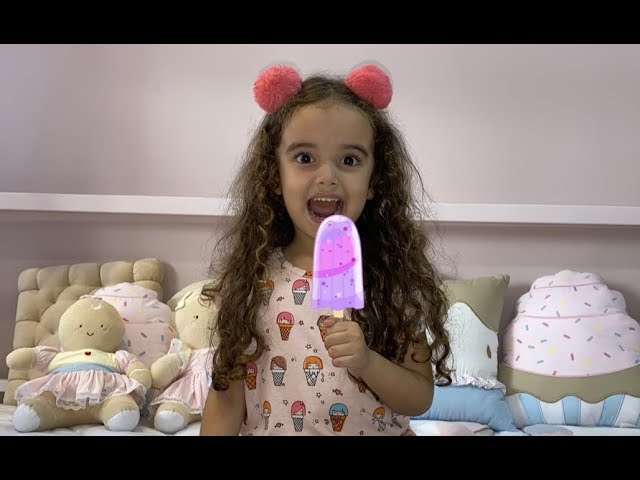
Where is `shelf`? shelf is located at coordinates (157, 209), (509, 216).